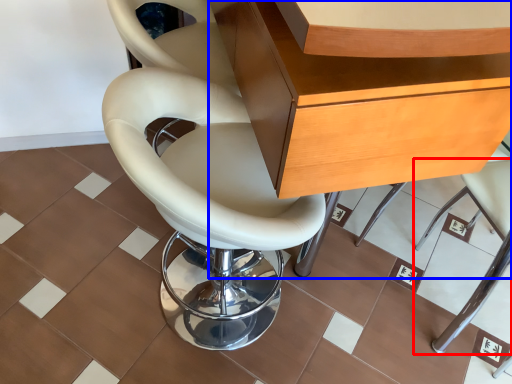
Question: Which object is closer to the camera taking this photo, chair (highlighted by a red box) or desk (highlighted by a blue box)?

Choices:
 (A) chair
 (B) desk

Answer: (B)